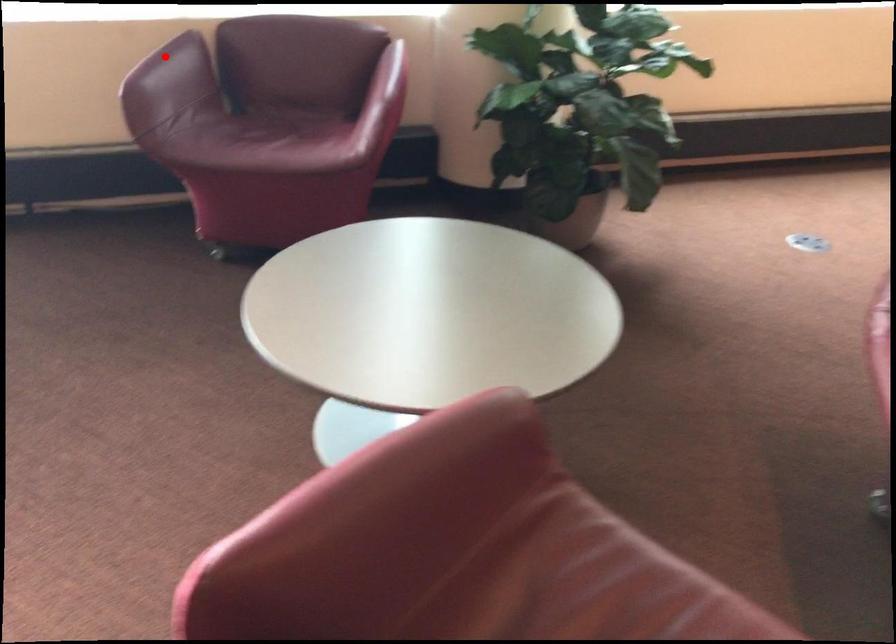
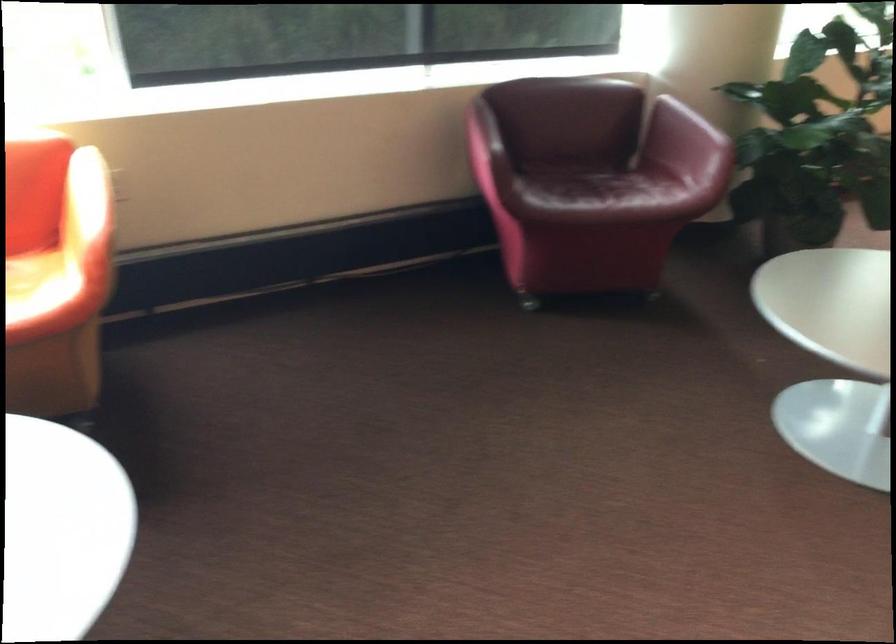
The point at the highlighted location is marked in the first image. Where is the corresponding point in the second image?

(469, 114)